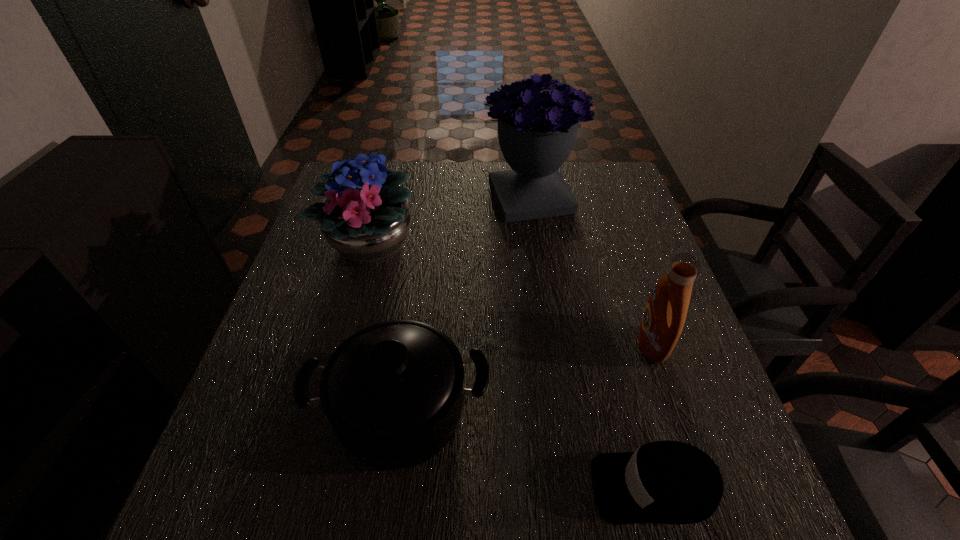
Find the location of a particular element. The width and height of the screenshot is (960, 540). free space between the detergent and the taller bouquet is located at coordinates (590, 271).

Where is `vacant space that is in between the shortest object and the shorter bouquet`? vacant space that is in between the shortest object and the shorter bouquet is located at coordinates (513, 366).

Find the location of a particular element. free space that is in between the detergent and the left bouquet is located at coordinates (511, 295).

I want to click on free spot between the detergent and the shorter bouquet, so click(511, 295).

Where is `empty location between the left bouquet and the detergent`? The height and width of the screenshot is (540, 960). empty location between the left bouquet and the detergent is located at coordinates (511, 295).

I want to click on free spot between the shorter bouquet and the tallest object, so click(451, 221).

Locate an element on the screen. This screenshot has width=960, height=540. empty location between the cap and the detergent is located at coordinates (652, 416).

Identify the location of unoccupied area between the second shortest object and the cap. (527, 449).

Locate an element on the screen. vacant area that lies between the cap and the fourth tallest object is located at coordinates (527, 449).

At what (x,y) coordinates should I click in order to perform the action: click on free spot between the left bouquet and the tallest object. Please return your answer as a coordinate pair (x, y). The height and width of the screenshot is (540, 960). Looking at the image, I should click on (451, 221).